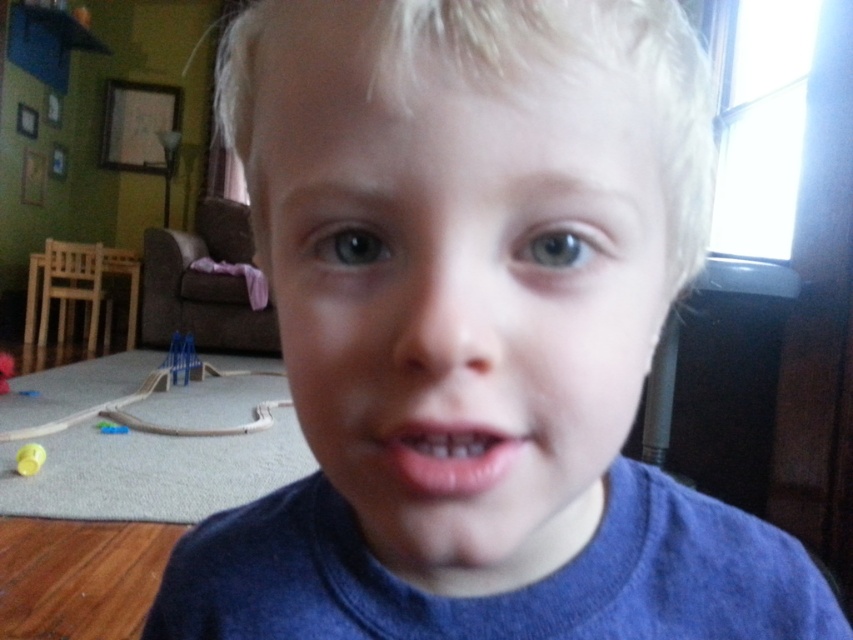
Question: Is pink glossy lips at center in front of yellow rubber ball at lower left?

Choices:
 (A) no
 (B) yes

Answer: (B)

Question: Estimate the real-world distances between objects in this image. Which object is closer to the yellow rubber ball at lower left?

Choices:
 (A) pink glossy lips at center
 (B) smooth skin face at center

Answer: (B)

Question: Estimate the real-world distances between objects in this image. Which object is farther from the yellow rubber ball at lower left?

Choices:
 (A) smooth skin face at center
 (B) pink glossy lips at center

Answer: (B)

Question: Estimate the real-world distances between objects in this image. Which object is farther from the pink glossy lips at center?

Choices:
 (A) smooth skin face at center
 (B) yellow rubber ball at lower left

Answer: (B)

Question: Is smooth skin face at center above yellow rubber ball at lower left?

Choices:
 (A) yes
 (B) no

Answer: (A)

Question: Is pink glossy lips at center thinner than yellow rubber ball at lower left?

Choices:
 (A) no
 (B) yes

Answer: (B)